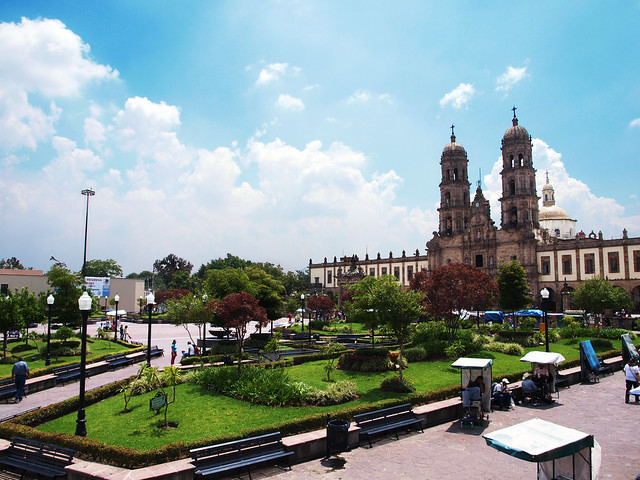
Identify the location of bench. (240, 459).